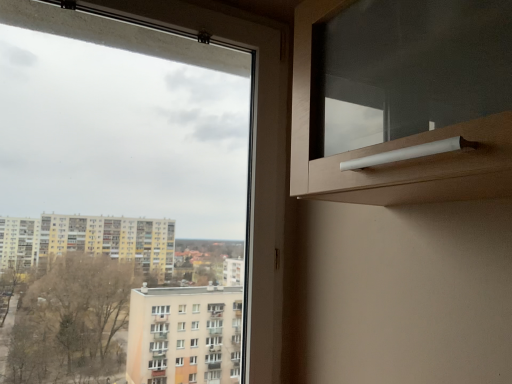
What do you see at coordinates (253, 152) in the screenshot? I see `transparent glass window at upper left` at bounding box center [253, 152].

Where is `transparent glass window at upper left`? The image size is (512, 384). transparent glass window at upper left is located at coordinates (253, 152).

Find the location of `transparent glass window at upper left`. transparent glass window at upper left is located at coordinates (253, 152).